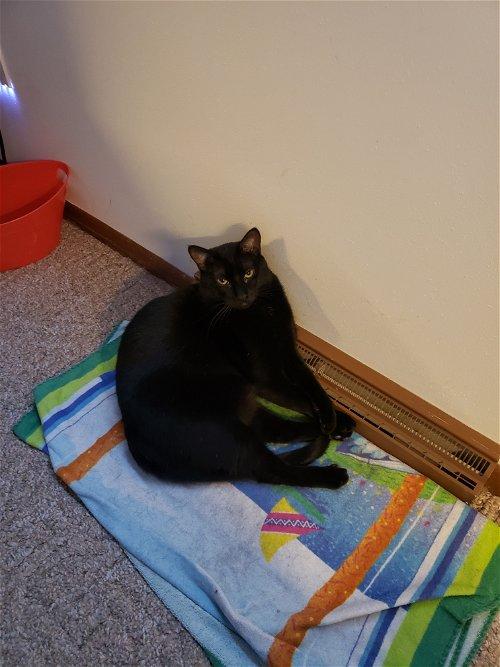
This screenshot has width=500, height=667. In order to click on towel in this screenshot , I will do `click(244, 544)`.